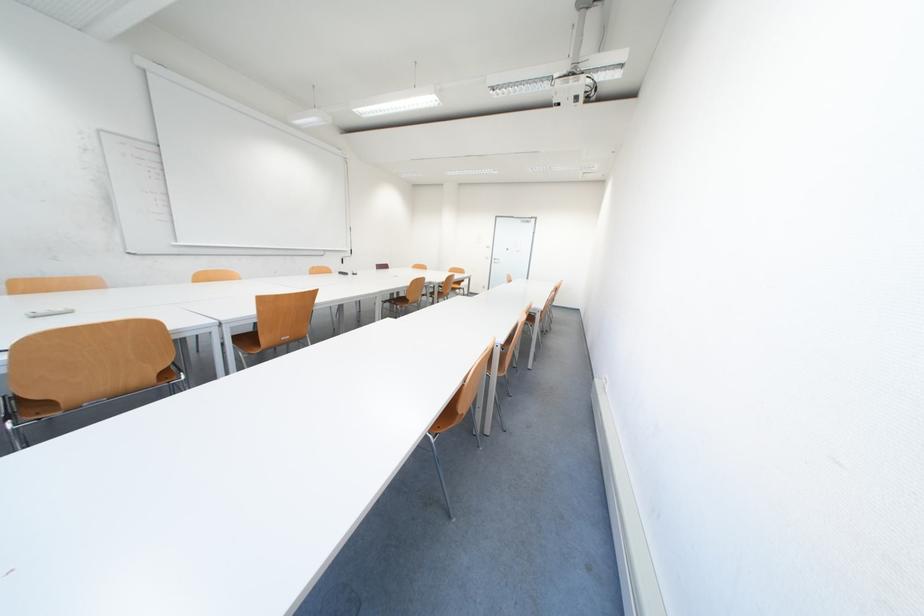
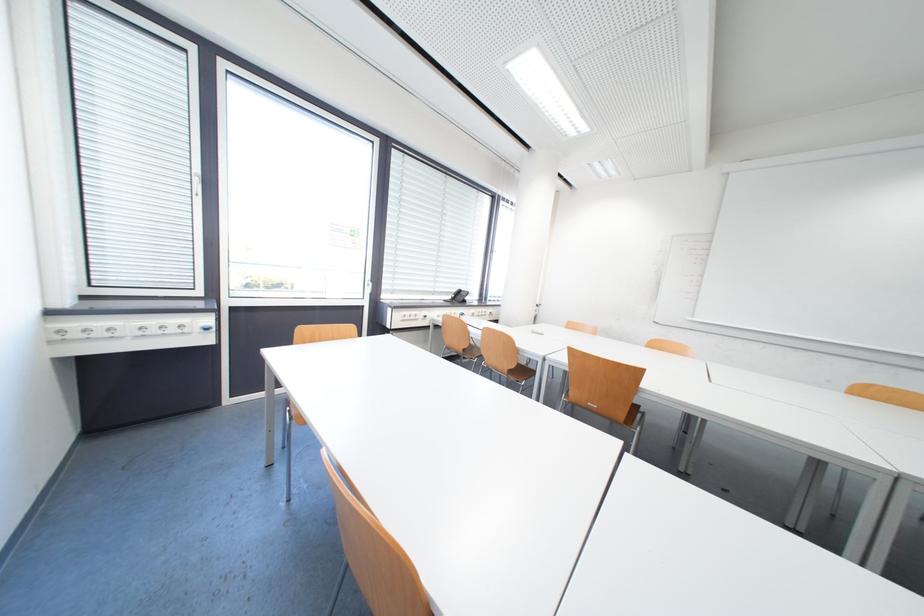
In the second image, find the point that corresponds to (x=143, y=384) in the first image.

(511, 369)